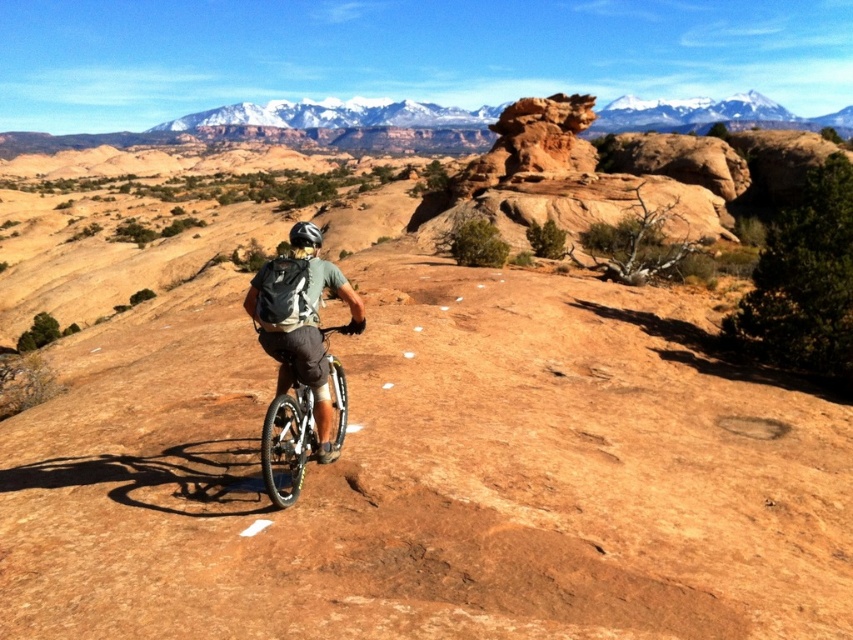
This screenshot has width=853, height=640. What do you see at coordinates (300, 326) in the screenshot? I see `matte gray backpack at center` at bounding box center [300, 326].

Where is `matte gray backpack at center`? The image size is (853, 640). matte gray backpack at center is located at coordinates (300, 326).

How distant is silver metallic bicycle at center from black matte bicycle helmet at center?

1.73 meters

Locate an element on the screen. The height and width of the screenshot is (640, 853). silver metallic bicycle at center is located at coordinates (287, 440).

Is point (299, 394) closer to camera compared to point (312, 243)?

No, it is behind (312, 243).

Find the location of a particular element. Image resolution: width=853 pixels, height=640 pixels. silver metallic bicycle at center is located at coordinates (287, 440).

Image resolution: width=853 pixels, height=640 pixels. What do you see at coordinates (300, 326) in the screenshot? I see `matte gray backpack at center` at bounding box center [300, 326].

Can you confirm if matte gray backpack at center is positioned to the left of silver metallic bicycle at center?

Incorrect, matte gray backpack at center is not on the left side of silver metallic bicycle at center.

Which is in front, point (250, 310) or point (273, 429)?

Point (273, 429) is more forward.

This screenshot has width=853, height=640. Identify the location of matte gray backpack at center. (300, 326).